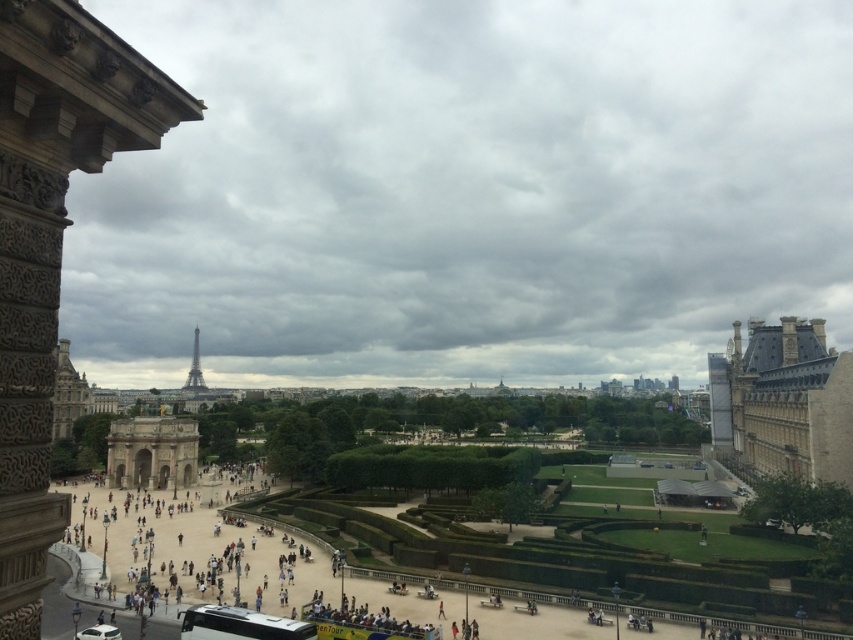
Which is above, brown stone building at right or white metallic bus at lower center?

brown stone building at right is above.

Is brown stone building at right taller than white metallic bus at lower center?

Yes.

Which is in front, point (778, 401) or point (206, 604)?

Point (206, 604)

You are a GUI agent. You are given a task and a screenshot of the screen. Output one action in this format:
    pyautogui.click(x=<x>, y=<y>)
    Task: Click on the brown stone building at right
    The width and height of the screenshot is (853, 640).
    Given the screenshot: What is the action you would take?
    [x=782, y=401]

Which is behind, point (61, 224) or point (248, 634)?

The point (248, 634) is behind.

Locate an element on the screen. Image resolution: width=853 pixels, height=640 pixels. smooth stone tower at left is located at coordinates (51, 244).

Is point (45, 358) positioned behind point (233, 616)?

No, (45, 358) is closer to viewer.

Locate an element on the screen. The image size is (853, 640). smooth stone tower at left is located at coordinates (51, 244).

Between smooth stone tower at left and shiny metallic eiffel tower at center, which one appears on the left side from the viewer's perspective?

shiny metallic eiffel tower at center

Identify the location of smooth stone tower at left. (51, 244).